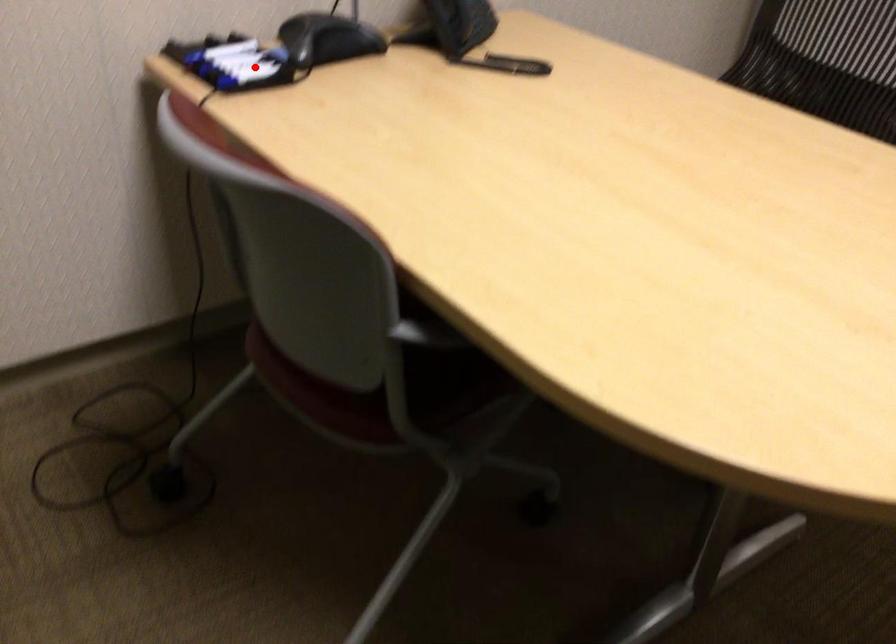
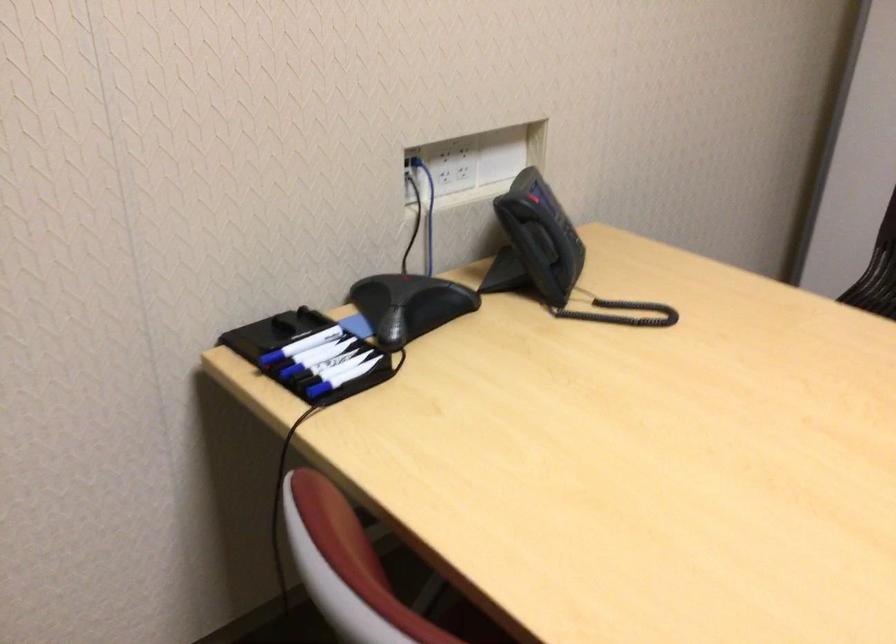
Question: I am providing you with two images of the same scene from different viewpoints. In image1, a red point is highlighted. Considering the same 3D point in image2, which of the following is correct?

Choices:
 (A) It is closer
 (B) It is farther

Answer: (A)